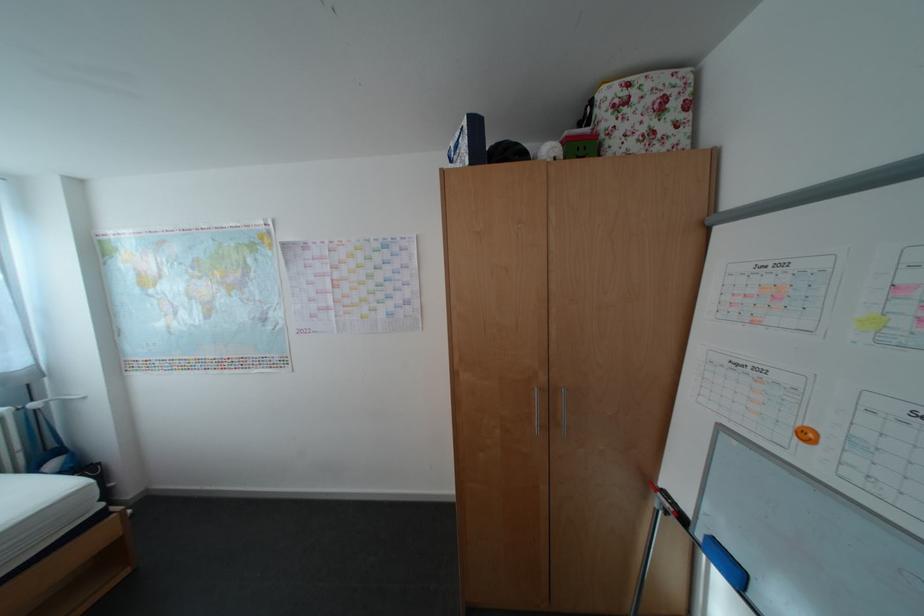
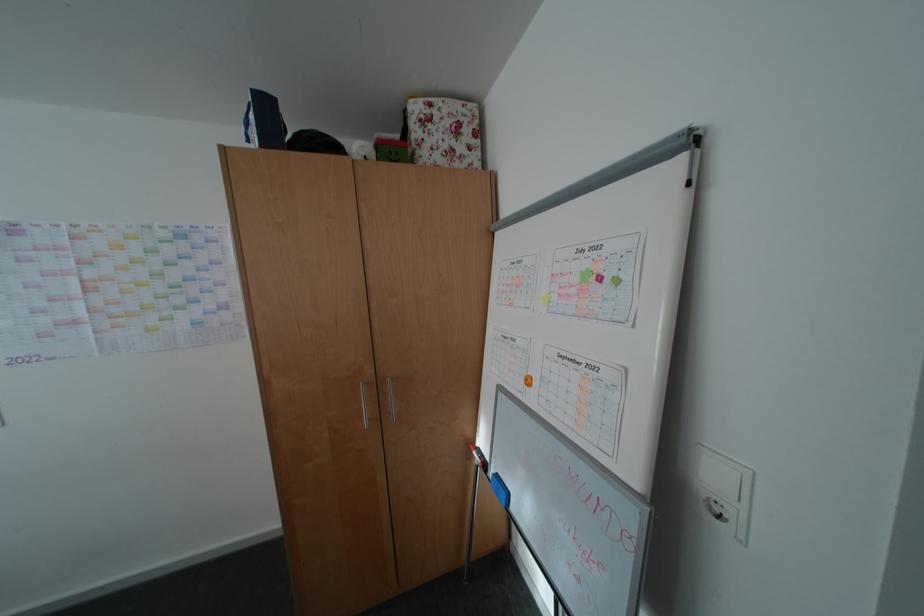
Question: The images are taken continuously from a first-person perspective. In which direction is your viewpoint rotating?

Choices:
 (A) Left
 (B) Right
 (C) Up
 (D) Down

Answer: (B)